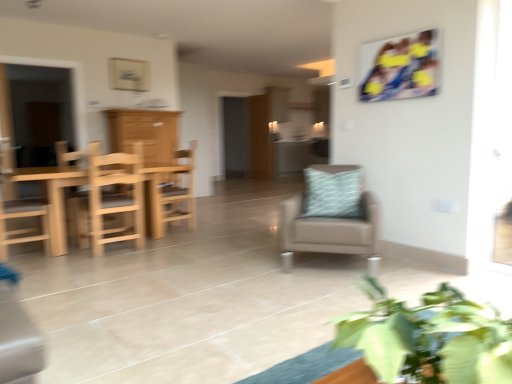
Question: Does wooden table at left have a lesser height compared to wooden door at center?

Choices:
 (A) no
 (B) yes

Answer: (B)

Question: Does wooden table at left have a lesser width compared to wooden door at center?

Choices:
 (A) no
 (B) yes

Answer: (A)

Question: Is wooden table at left directly adjacent to wooden door at center?

Choices:
 (A) no
 (B) yes

Answer: (A)

Question: Does wooden table at left lie behind wooden door at center?

Choices:
 (A) yes
 (B) no

Answer: (B)

Question: Is wooden table at left at the left side of wooden door at center?

Choices:
 (A) no
 (B) yes

Answer: (B)

Question: From the image's perspective, is wooden chair at center, which is counted as the 3th chair, starting from the left, above or below natural wood chair at left, positioned as the 3th chair in right-to-left order?

Choices:
 (A) below
 (B) above

Answer: (B)

Question: Looking at the image, does wooden chair at center, which is counted as the 3th chair, starting from the left, seem bigger or smaller compared to natural wood chair at left, acting as the 2th chair starting from the left?

Choices:
 (A) big
 (B) small

Answer: (B)

Question: From their relative heights in the image, would you say wooden chair at center, which is the 2th chair from right to left, is taller or shorter than natural wood chair at left, acting as the 2th chair starting from the left?

Choices:
 (A) tall
 (B) short

Answer: (B)

Question: Based on their positions, is wooden chair at center, which is counted as the 3th chair, starting from the left, located to the left or right of natural wood chair at left, acting as the 2th chair starting from the left?

Choices:
 (A) left
 (B) right

Answer: (B)

Question: Is natural wood chair at left, acting as the 2th chair starting from the left, taller or shorter than wooden table at left?

Choices:
 (A) tall
 (B) short

Answer: (B)

Question: From a real-world perspective, is natural wood chair at left, acting as the 2th chair starting from the left, above or below wooden table at left?

Choices:
 (A) below
 (B) above

Answer: (A)

Question: In the image, is natural wood chair at left, acting as the 2th chair starting from the left, positioned in front of or behind wooden table at left?

Choices:
 (A) behind
 (B) front

Answer: (B)

Question: Considering the positions of point (72, 213) and point (9, 125), is point (72, 213) closer or farther from the camera than point (9, 125)?

Choices:
 (A) farther
 (B) closer

Answer: (B)

Question: In terms of size, does light blue textured pillow at center appear bigger or smaller than wooden cabinet at left?

Choices:
 (A) big
 (B) small

Answer: (B)

Question: From a real-world perspective, is light blue textured pillow at center physically located above or below wooden cabinet at left?

Choices:
 (A) below
 (B) above

Answer: (A)